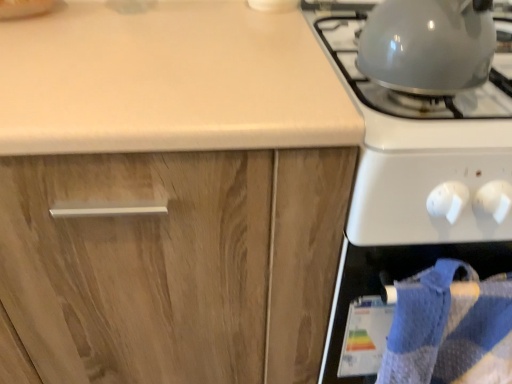
Question: In terms of height, does wooden cabinet at center look taller or shorter compared to blue textured towel at lower right?

Choices:
 (A) tall
 (B) short

Answer: (A)

Question: Considering their positions, is wooden cabinet at center located in front of or behind blue textured towel at lower right?

Choices:
 (A) front
 (B) behind

Answer: (A)

Question: Which object is the closest to the glossy white gas stove at right, which is the first gas stove from right to left?

Choices:
 (A) wooden cabinet at center
 (B) blue textured towel at lower right
 (C) shiny metallic kettle at upper right, which is the first gas stove in left-to-right order

Answer: (C)

Question: Considering the real-world distances, which object is farthest from the wooden cabinet at center?

Choices:
 (A) shiny metallic kettle at upper right, which is the first gas stove in left-to-right order
 (B) blue textured towel at lower right
 (C) glossy white gas stove at right, which is the first gas stove from right to left

Answer: (A)